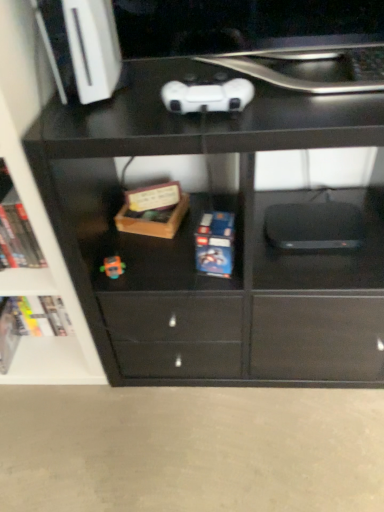
Image resolution: width=384 pixels, height=512 pixels. Identify the location of vacant area that lies between black matte laptop keyboard at upper center and white matte game controller at upper center. (313, 91).